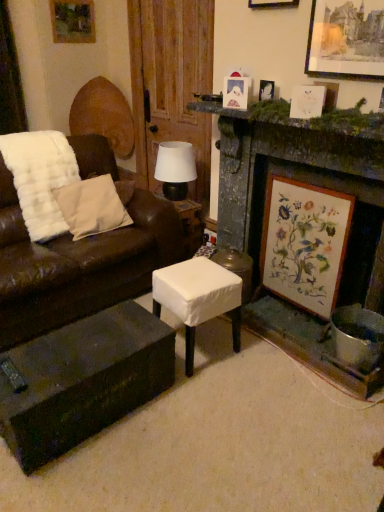
The image size is (384, 512). I want to click on vacant area that is situated to the right of white fabric-covered stool at center, so click(255, 355).